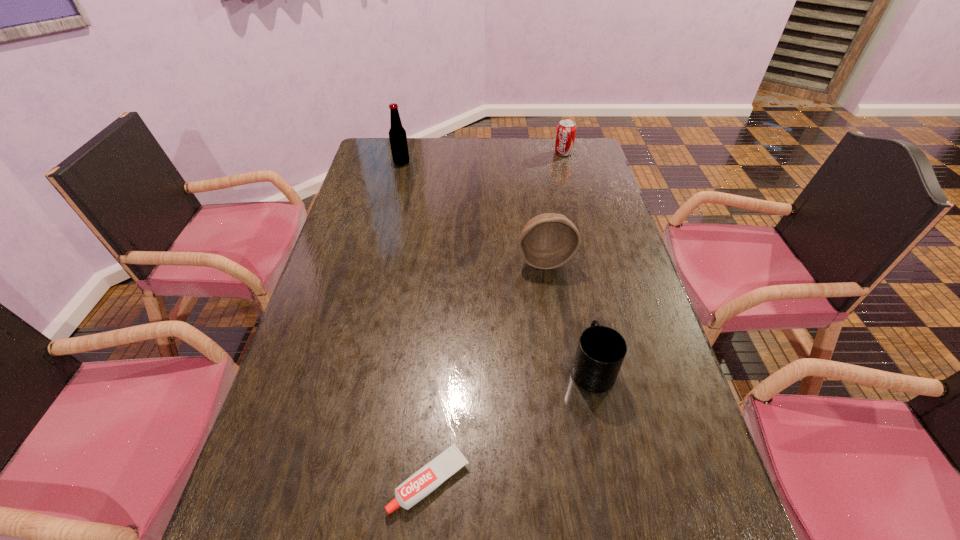
The width and height of the screenshot is (960, 540). Identify the location of free location located 0.380m on the front of the farthest object. (580, 218).

I want to click on free space located on the side of the mug with the handle, so click(x=581, y=315).

Locate an element on the screen. vacant space located on the side of the mug with the handle is located at coordinates (572, 275).

Identify the location of vacant region located on the side of the mug with the handle. (576, 293).

Where is `vacant point located 0.050m on the right of the shortest object`? vacant point located 0.050m on the right of the shortest object is located at coordinates (494, 480).

Locate an element on the screen. beer bottle that is at the far edge is located at coordinates (397, 135).

Locate an element on the screen. soda present at the far edge is located at coordinates (566, 130).

Image resolution: width=960 pixels, height=540 pixels. Find the location of `object situated at the left edge`. object situated at the left edge is located at coordinates (397, 135).

The height and width of the screenshot is (540, 960). I want to click on soda situated at the right edge, so click(566, 130).

Locate an element on the screen. The width and height of the screenshot is (960, 540). mug located at the right edge is located at coordinates (601, 350).